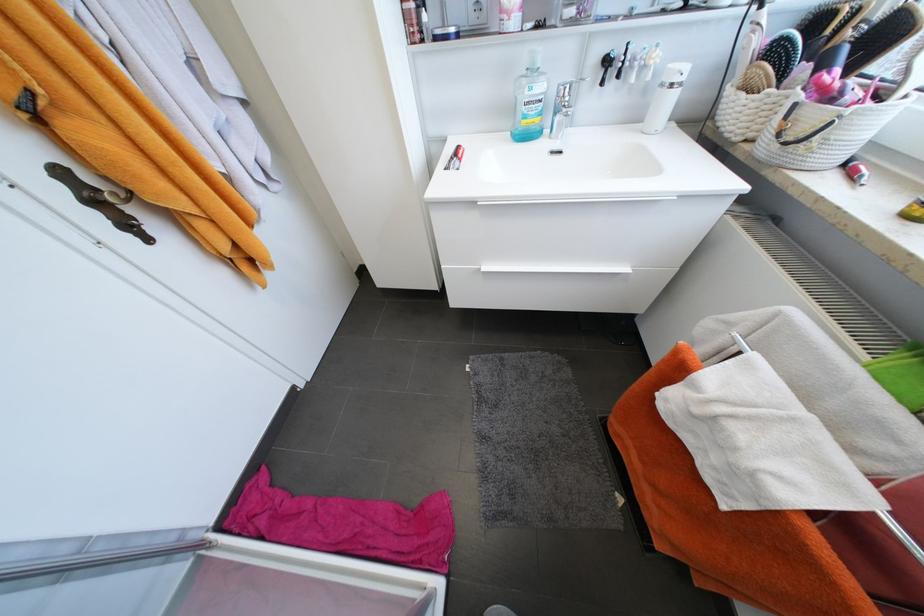
Find where to pull the top drawer handle. Please return your answer as a coordinate pair (x, y).

(575, 200)